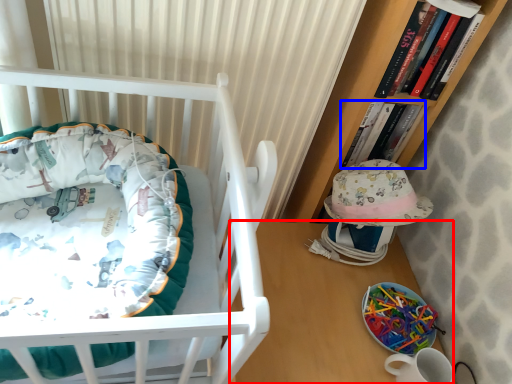
Question: Among these objects, which one is farthest to the camera, table (highlighted by a red box) or book (highlighted by a blue box)?

Choices:
 (A) table
 (B) book

Answer: (B)